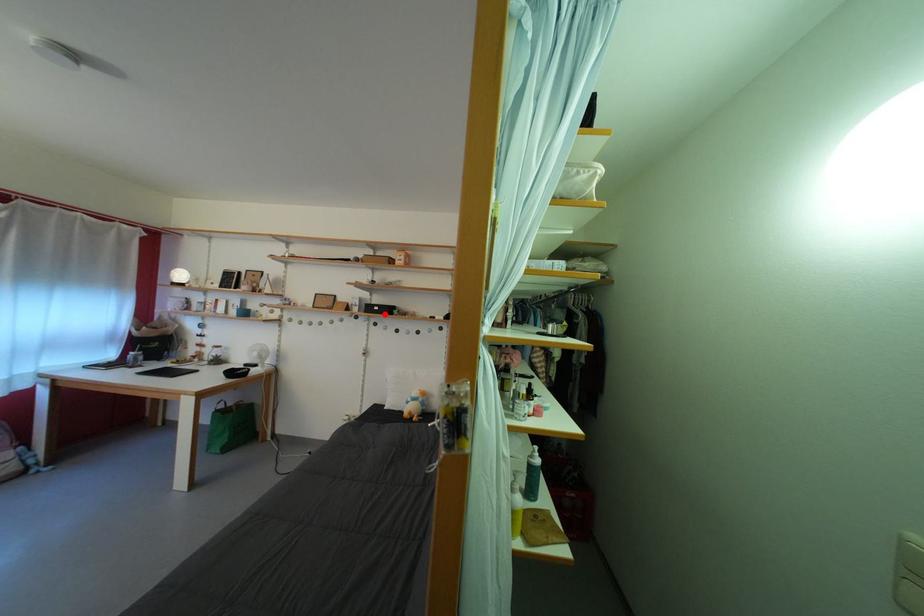
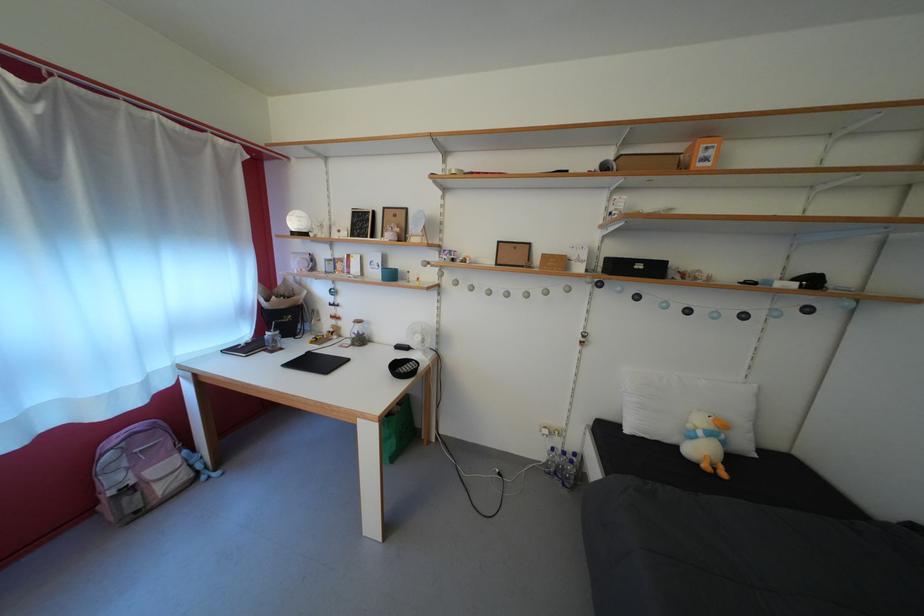
Locate, in the second image, the point that corresponds to the highlighted location in the first image.

(648, 273)